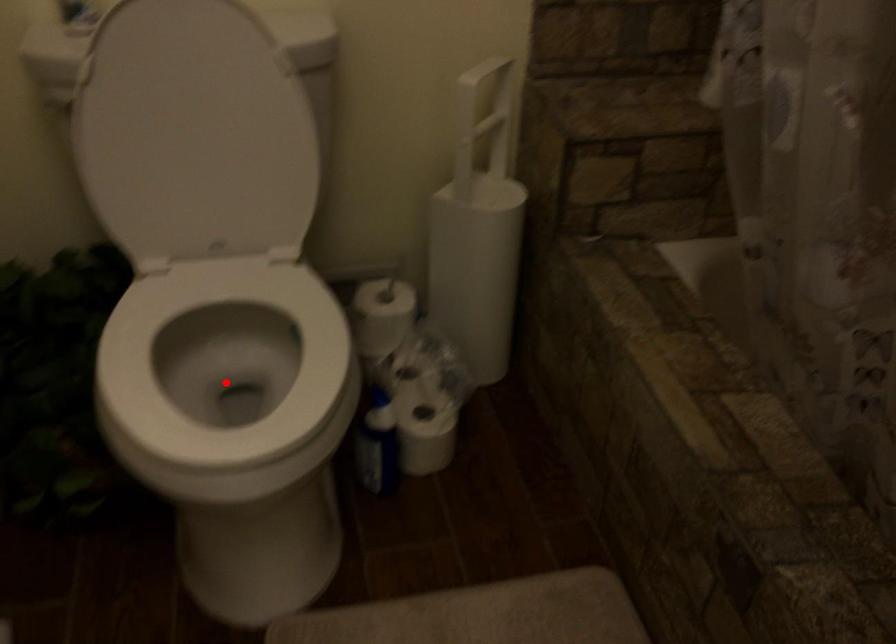
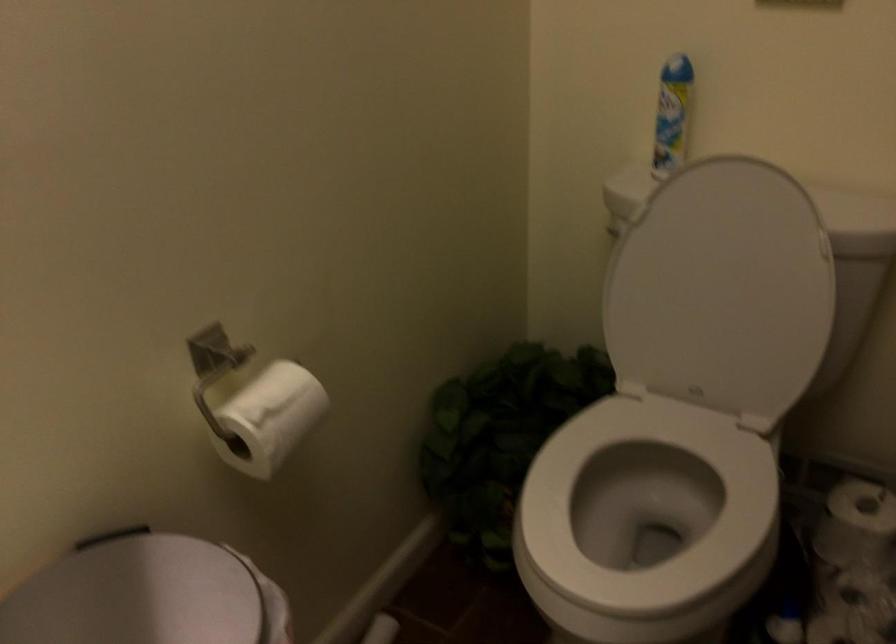
In the second image, find the point that corresponds to the highlighted location in the first image.

(645, 516)